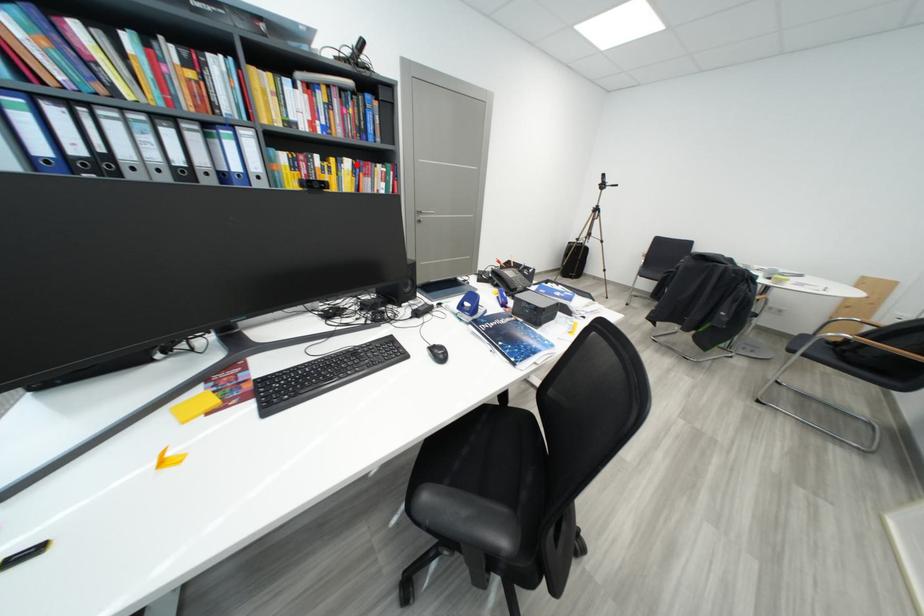
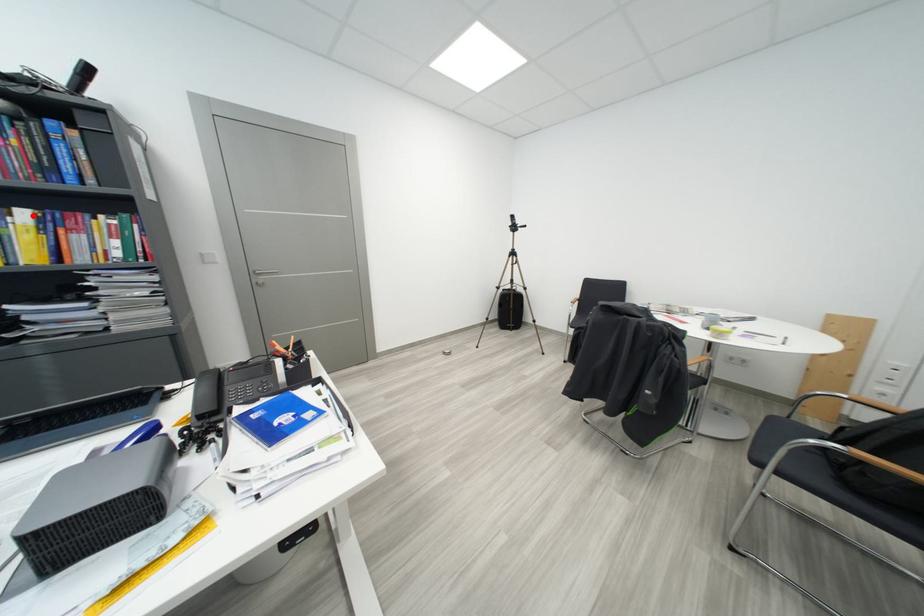
I am providing you with two images of the same scene from different viewpoints. A red point is marked on the first image and another point is marked on the second image. Does the point marked in image1 correspond to the same location as the one in image2?

Yes